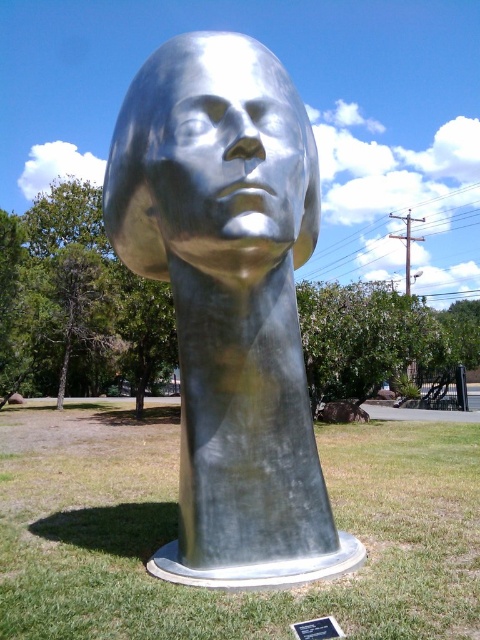
Is shiny metallic face at center taller than black metal plaque at center?

Yes, shiny metallic face at center is taller than black metal plaque at center.

Is shiny metallic face at center wider than black metal plaque at center?

Indeed, shiny metallic face at center has a greater width compared to black metal plaque at center.

Locate an element on the screen. The image size is (480, 640). shiny metallic face at center is located at coordinates (232, 157).

Between shiny metallic head at center and shiny metallic face at center, which one is positioned higher?

shiny metallic face at center is above.

Is shiny metallic head at center positioned in front of shiny metallic face at center?

Yes, shiny metallic head at center is in front of shiny metallic face at center.

Find the location of a particular element. The image size is (480, 640). shiny metallic head at center is located at coordinates (229, 301).

Can you confirm if green grass at center is taller than black metal plaque at center?

Correct, green grass at center is much taller as black metal plaque at center.

In the scene shown: Between green grass at center and black metal plaque at center, which one has less height?

black metal plaque at center

Is point (129, 522) in front of point (319, 621)?

That is False.

Identify the location of green grass at center. 219,589.